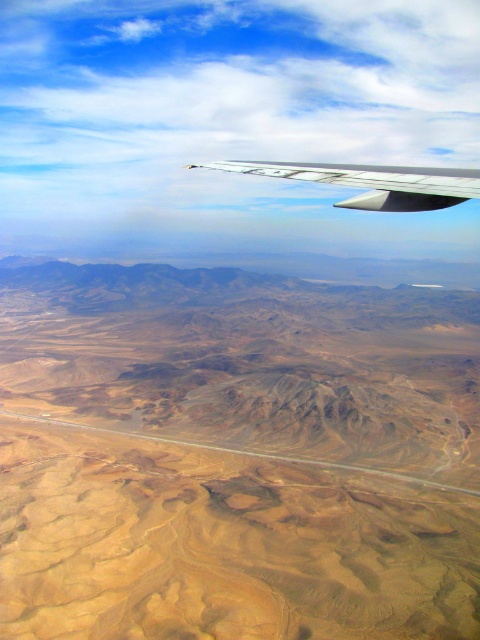
You are a pilot flying at an altitude of 1,000 meters. You notice the desert sand at lower center and the silver metallic wing at upper center in your view. How far apart are these two objects from each other?

The desert sand at lower center is 436.06 meters from the silver metallic wing at upper center.

You are a pilot looking at the desert landscape below through the airplane window. You notice a specific point marked at coordinates point [235,456]. Can you identify what this point corresponds to in the desert scene?

The point [235,456] corresponds to the desert sand at lower center.

You are a passenger on an airplane and notice the desert sand at lower center and the silver metallic wing at upper center through the window. Which object is closer to you?

The desert sand at lower center is closer to you because the silver metallic wing at upper center is behind it.